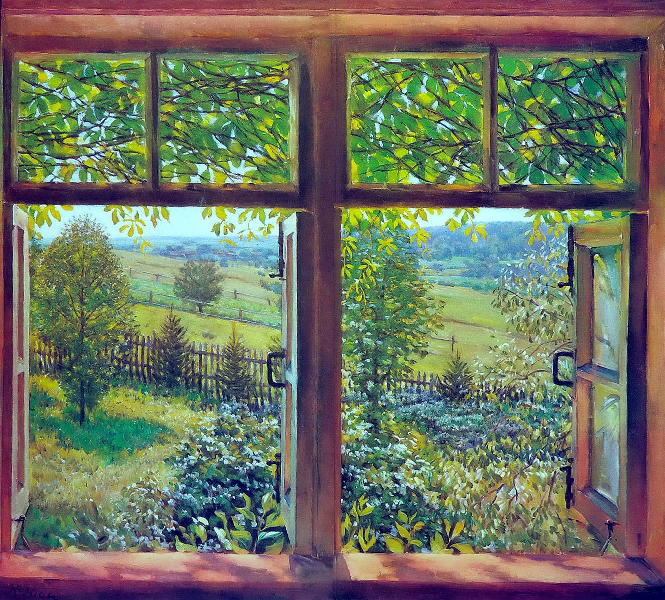
In order to click on open window in this screenshot , I will do pos(336,534), pos(585,403), pos(292,403), pos(26,413).